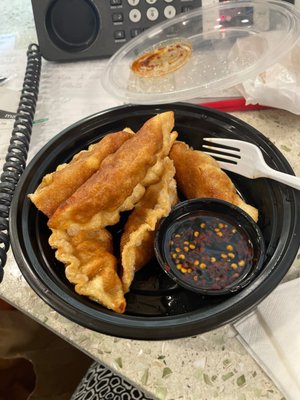
The image size is (300, 400). In order to click on telephone cord in this screenshot , I will do `click(19, 156)`.